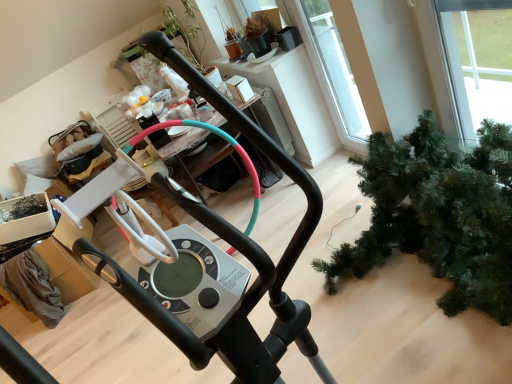
Question: Is metallic silver elliptical trainer at center bigger than green matte christmas tree at lower right?

Choices:
 (A) no
 (B) yes

Answer: (B)

Question: Does metallic silver elliptical trainer at center lie behind green matte christmas tree at lower right?

Choices:
 (A) yes
 (B) no

Answer: (B)

Question: Is metallic silver elliptical trainer at center positioned far away from green matte christmas tree at lower right?

Choices:
 (A) no
 (B) yes

Answer: (A)

Question: Is metallic silver elliptical trainer at center in front of green matte christmas tree at lower right?

Choices:
 (A) no
 (B) yes

Answer: (B)

Question: From the image's perspective, is metallic silver elliptical trainer at center over green matte christmas tree at lower right?

Choices:
 (A) yes
 (B) no

Answer: (B)

Question: Is metallic silver elliptical trainer at center positioned with its back to green matte christmas tree at lower right?

Choices:
 (A) yes
 (B) no

Answer: (B)

Question: From the image's perspective, is green matte christmas tree at lower right beneath metallic silver elliptical trainer at center?

Choices:
 (A) yes
 (B) no

Answer: (B)

Question: Is green matte christmas tree at lower right at the right side of metallic silver elliptical trainer at center?

Choices:
 (A) yes
 (B) no

Answer: (A)

Question: Does green matte christmas tree at lower right have a smaller size compared to metallic silver elliptical trainer at center?

Choices:
 (A) no
 (B) yes

Answer: (B)

Question: Are green matte christmas tree at lower right and metallic silver elliptical trainer at center making contact?

Choices:
 (A) yes
 (B) no

Answer: (B)

Question: Considering the relative positions of green matte christmas tree at lower right and metallic silver elliptical trainer at center in the image provided, is green matte christmas tree at lower right to the left of metallic silver elliptical trainer at center from the viewer's perspective?

Choices:
 (A) no
 (B) yes

Answer: (A)

Question: Considering the relative sizes of green matte christmas tree at lower right and metallic silver elliptical trainer at center in the image provided, is green matte christmas tree at lower right taller than metallic silver elliptical trainer at center?

Choices:
 (A) yes
 (B) no

Answer: (B)

Question: From a real-world perspective, relative to metallic silver elliptical trainer at center, is green matte christmas tree at lower right vertically above or below?

Choices:
 (A) above
 (B) below

Answer: (B)